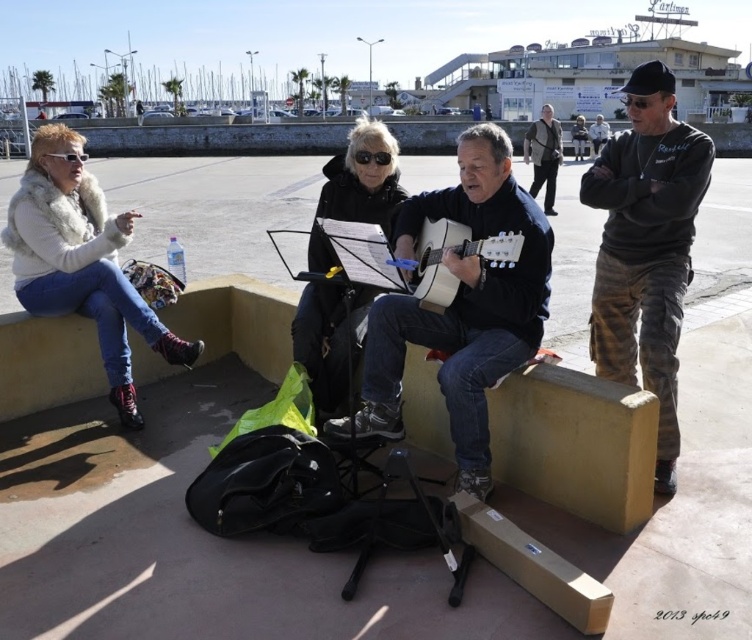
Who is taller, matte black guitar at center or fuzzy white fur vest at left?

With more height is matte black guitar at center.

Is matte black guitar at center thinner than fuzzy white fur vest at left?

Indeed, matte black guitar at center has a lesser width compared to fuzzy white fur vest at left.

Is point (496, 328) more distant than point (88, 180)?

That is False.

Locate an element on the screen. This screenshot has height=640, width=752. matte black guitar at center is located at coordinates (462, 305).

Describe the element at coordinates (462, 305) in the screenshot. I see `matte black guitar at center` at that location.

Where is `matte black guitar at center`? Image resolution: width=752 pixels, height=640 pixels. matte black guitar at center is located at coordinates (462, 305).

Does black cotton sweatshirt at right have a greater width compared to acoustic guitar at center?

Indeed, black cotton sweatshirt at right has a greater width compared to acoustic guitar at center.

Can you confirm if black cotton sweatshirt at right is positioned below acoustic guitar at center?

Indeed, black cotton sweatshirt at right is positioned under acoustic guitar at center.

Who is more distant from viewer, (644,388) or (508,256)?

Point (644,388)

This screenshot has width=752, height=640. Find the location of `black cotton sweatshirt at right`. black cotton sweatshirt at right is located at coordinates (646, 248).